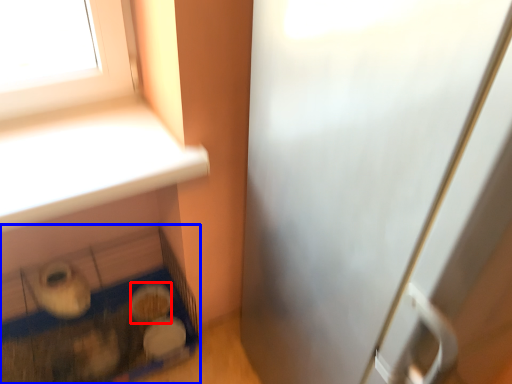
Question: Among these objects, which one is nearest to the camera, food (highlighted by a red box) or bird cage (highlighted by a blue box)?

Choices:
 (A) food
 (B) bird cage

Answer: (B)